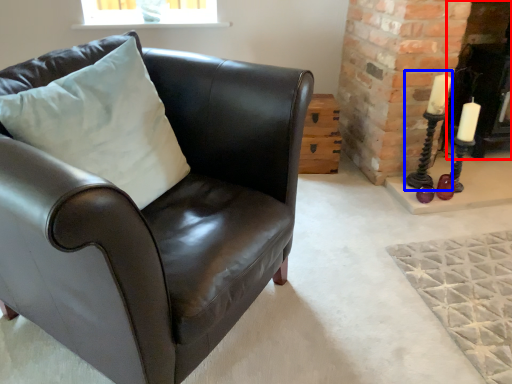
Question: Which object is closer to the camera taking this photo, fireplace (highlighted by a red box) or candle holder (highlighted by a blue box)?

Choices:
 (A) fireplace
 (B) candle holder

Answer: (B)